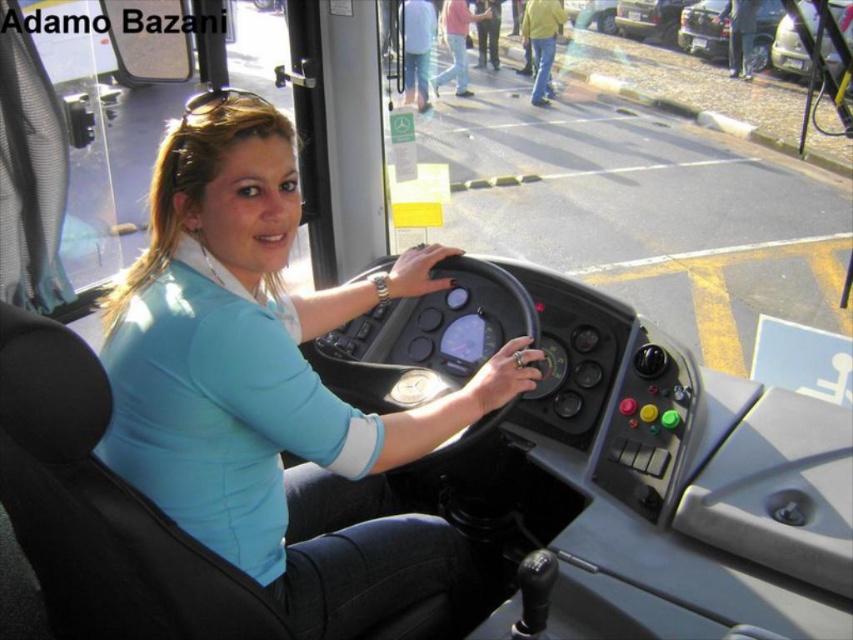
Question: Is blue fabric shirt at center to the right of metallic silver car at upper right from the viewer's perspective?

Choices:
 (A) yes
 (B) no

Answer: (B)

Question: Is the position of blue fabric shirt at center more distant than that of metallic silver car at upper right?

Choices:
 (A) yes
 (B) no

Answer: (B)

Question: Does blue fabric shirt at center come behind metallic silver car at upper right?

Choices:
 (A) no
 (B) yes

Answer: (A)